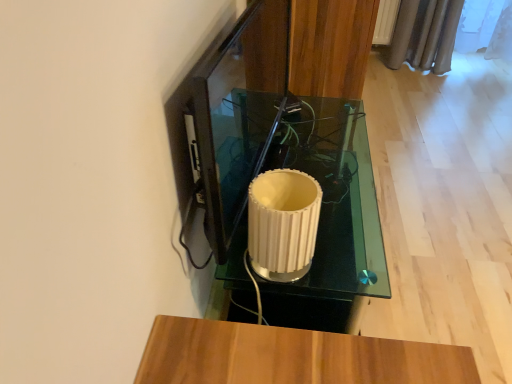
The image size is (512, 384). I want to click on white ribbed lampshade at center, so click(x=330, y=216).

Describe the element at coordinates (330, 216) in the screenshot. I see `white ribbed lampshade at center` at that location.

Locate an element on the screen. white ribbed lampshade at center is located at coordinates (330, 216).